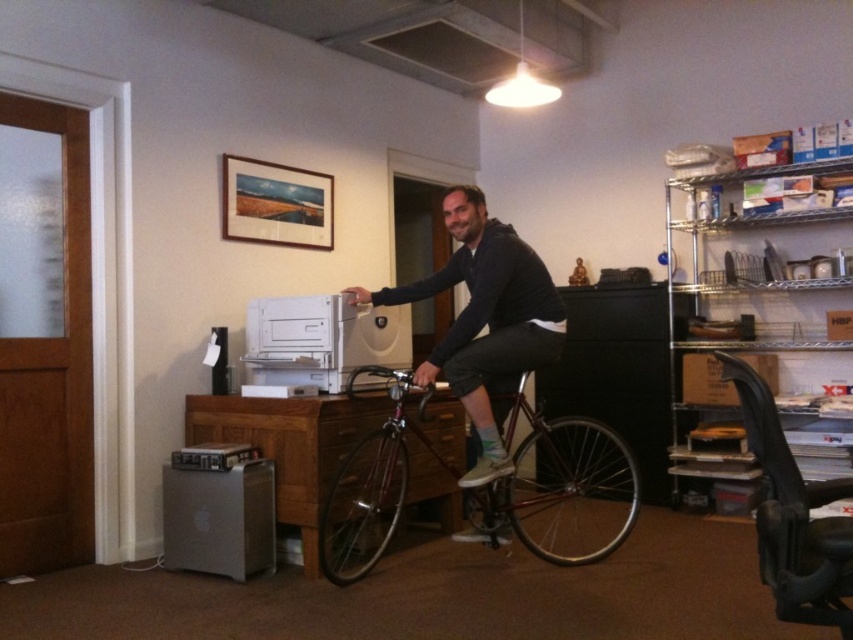
A person is standing at the point marked as point (556, 300) in the room. They want to move towards the red bicycle in the center. Is there enough space to walk directly to the bicycle without moving any furniture?

The distance between the person at point (556, 300) and the red bicycle in the center is 3.27 meters. Since there is no mention of obstacles between them in the scene description, there should be enough space to walk directly to the bicycle without moving any furniture.

You are standing in the room and want to move towards the shiny metallic bicycle at center. Which direction should you move relative to the wooden desk on the left?

The shiny metallic bicycle at center is located at point [563,481]. Since the wooden desk on the left is to your left, the bicycle is to your right. Move towards the right side of the wooden desk on the left to reach the shiny metallic bicycle at center.

You are standing at the entrance of the room. Where is the shiny metallic bicycle at center located in relation to your position?

The shiny metallic bicycle at center is located at point 0.752 on the x axis and 0.661 on the y axis relative to your position at the entrance.